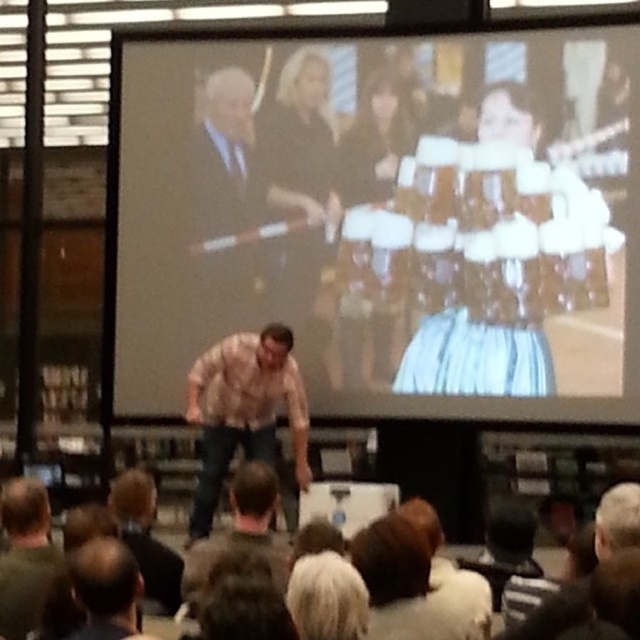
Question: Considering the real-world distances, which object is closest to the dark brown hair at lower center?

Choices:
 (A) white wool sweater at lower center
 (B) plaid shirt at center
 (C) white matte projection screen at upper center

Answer: (A)

Question: Among these points, which one is farthest from the camera?

Choices:
 (A) (621, 544)
 (B) (188, 531)
 (C) (461, 172)
 (D) (403, 609)

Answer: (B)

Question: Can you confirm if white matte projection screen at upper center is wider than white wool sweater at lower center?

Choices:
 (A) yes
 (B) no

Answer: (A)

Question: Is plaid shirt at center closer to the viewer compared to dark brown hair at lower center?

Choices:
 (A) no
 (B) yes

Answer: (A)

Question: Which point appears farthest from the camera in this image?

Choices:
 (A) (637, 532)
 (B) (134, 346)
 (C) (372, 582)
 (D) (218, 406)

Answer: (B)

Question: Is white matte projection screen at upper center above plaid shirt at center?

Choices:
 (A) no
 (B) yes

Answer: (B)